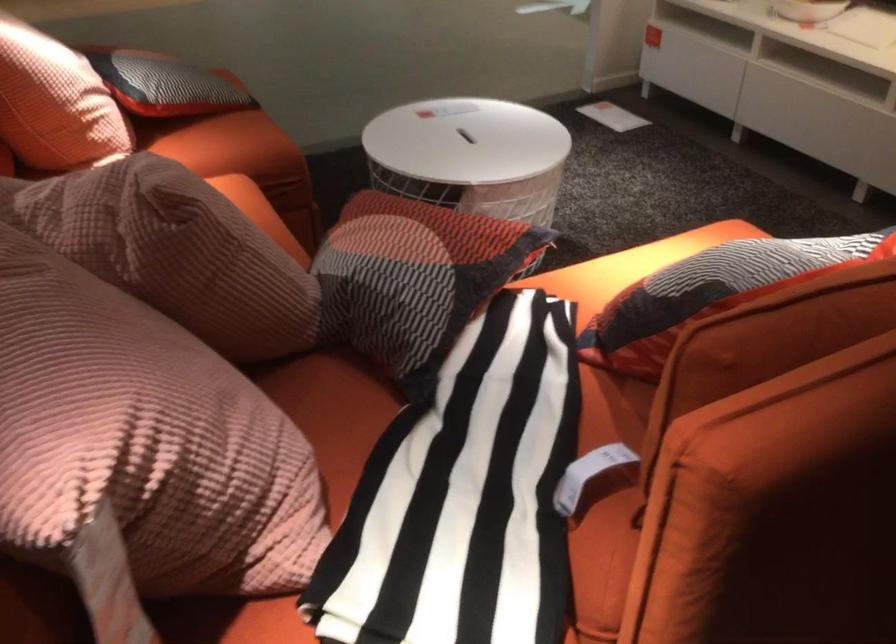
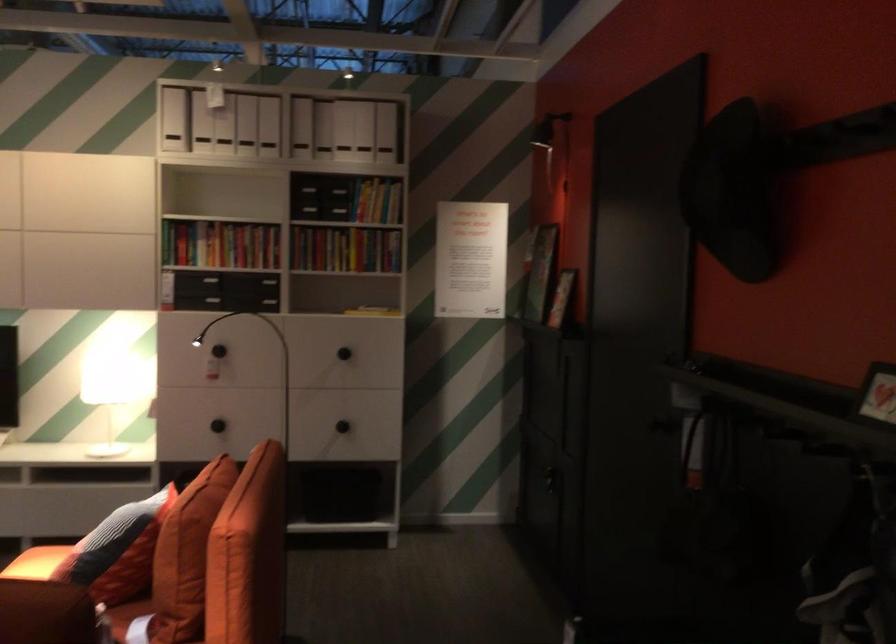
The point at (664, 313) is marked in the first image. Where is the corresponding point in the second image?

(117, 551)